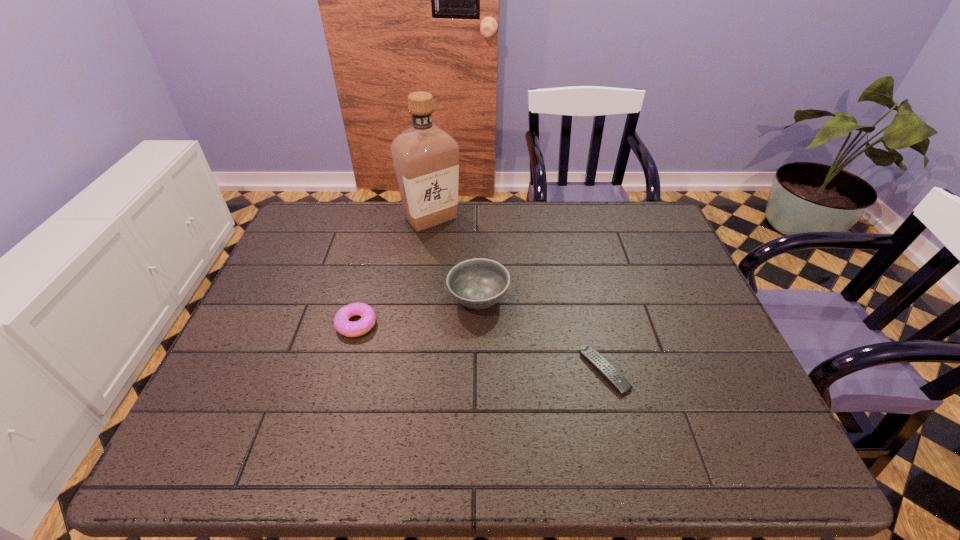
Locate an element on the screen. The width and height of the screenshot is (960, 540). free space between the tallest object and the rightmost object is located at coordinates (517, 295).

Where is `free area in between the rightmost object and the bowl`? Image resolution: width=960 pixels, height=540 pixels. free area in between the rightmost object and the bowl is located at coordinates (541, 335).

Where is `free spot between the tallest object and the third tallest object`? free spot between the tallest object and the third tallest object is located at coordinates (394, 271).

You are a GUI agent. You are given a task and a screenshot of the screen. Output one action in this format:
    pyautogui.click(x=<x>, y=<y>)
    Task: Click on the empty space between the liquor and the nearest object
    Image resolution: width=960 pixels, height=540 pixels.
    Given the screenshot: What is the action you would take?
    pyautogui.click(x=517, y=295)

Find the location of a particular element. unoccupied area between the shortest object and the second tallest object is located at coordinates (541, 335).

Find the location of a particular element. Image resolution: width=960 pixels, height=540 pixels. free space between the doughnut and the farthest object is located at coordinates tap(394, 271).

Locate an element on the screen. The height and width of the screenshot is (540, 960). free spot between the liquor and the third tallest object is located at coordinates (394, 271).

I want to click on unoccupied area between the farthest object and the bowl, so click(455, 259).

Choose which object is the second nearest neighbor to the remote control. Please provide its 2D coordinates. Your answer should be formatted as a tuple, i.e. [(x, y)], where the tuple contains the x and y coordinates of a point satisfying the conditions above.

[(347, 328)]

At what (x,y) coordinates should I click in order to perform the action: click on object that is the third closest to the nearest object. Please return your answer as a coordinate pair (x, y). The height and width of the screenshot is (540, 960). Looking at the image, I should click on (426, 159).